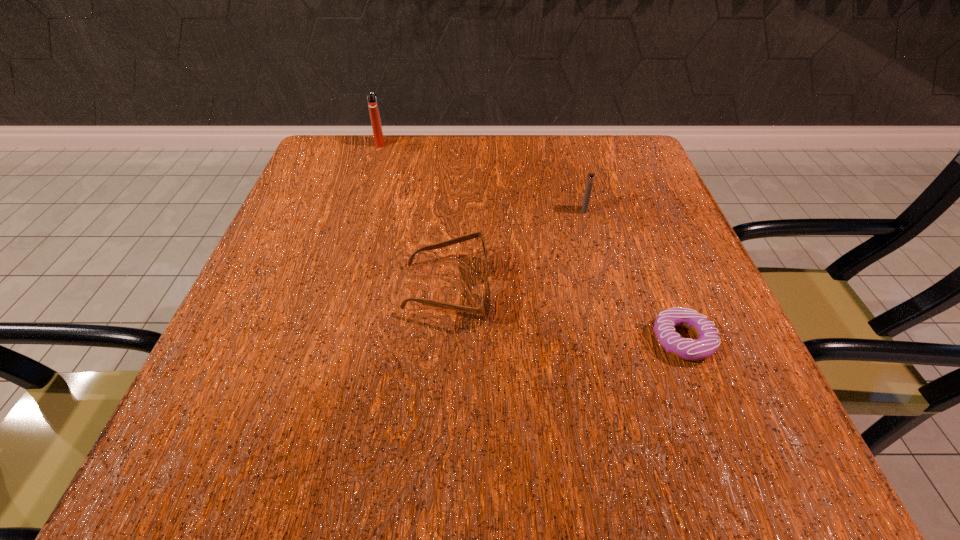
This screenshot has height=540, width=960. What are the coordinates of `vacant space located on the frames of the sunglasses` in the screenshot? It's located at (642, 289).

Locate an element on the screen. vacant region located on the left of the shortest object is located at coordinates (554, 340).

What are the coordinates of `object at the far edge` in the screenshot? It's located at (372, 101).

Locate an element on the screen. The image size is (960, 540). object at the left edge is located at coordinates (372, 101).

Where is `igniter present at the right edge`? The height and width of the screenshot is (540, 960). igniter present at the right edge is located at coordinates (590, 178).

At what (x,y) coordinates should I click in order to perform the action: click on doughnut situated at the right edge. Please return your answer as a coordinate pair (x, y). The height and width of the screenshot is (540, 960). Looking at the image, I should click on (708, 341).

The image size is (960, 540). Find the location of `object that is at the far left corner`. object that is at the far left corner is located at coordinates (372, 101).

In the image, there is a desktop. Identify the location of blank space at the far edge. The image size is (960, 540). (563, 140).

In the image, there is a desktop. Where is `vacant area at the near edge`? The height and width of the screenshot is (540, 960). vacant area at the near edge is located at coordinates (444, 419).

At what (x,y) coordinates should I click in order to perform the action: click on free point at the left edge. Please return your answer as a coordinate pair (x, y). This screenshot has height=540, width=960. Looking at the image, I should click on (255, 313).